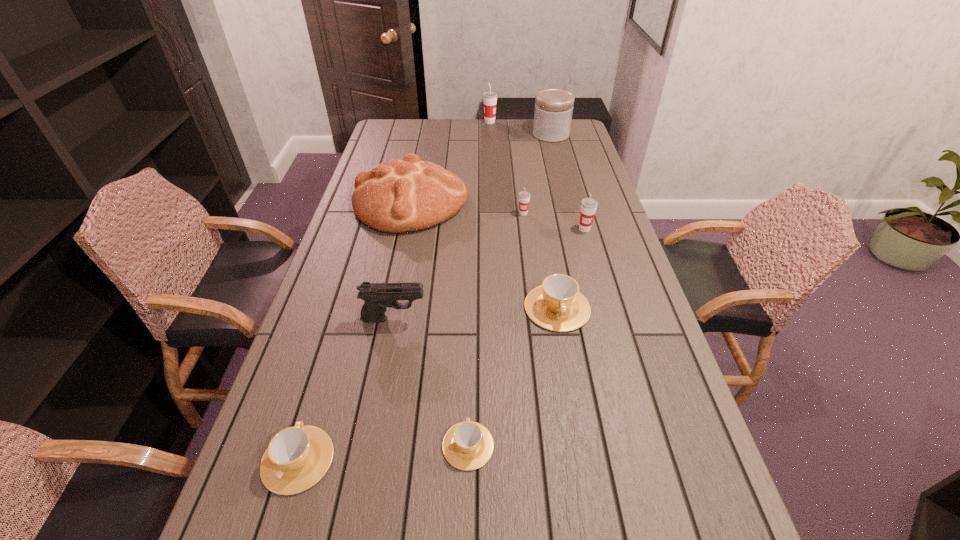
What are the coordinates of `free space that is in between the farthest brown cup and the fifth tallest cup` in the screenshot? It's located at (427, 384).

The height and width of the screenshot is (540, 960). Identify the location of vacant area between the rightmost red cup and the jar. (567, 182).

Find the location of a particular element. This screenshot has height=540, width=960. free space between the biggest brown cup and the second red cup from right to left is located at coordinates (540, 261).

Where is `vacant region between the eighth nearest object and the leftmost red cup`? The image size is (960, 540). vacant region between the eighth nearest object and the leftmost red cup is located at coordinates (520, 128).

The width and height of the screenshot is (960, 540). In order to click on vacant area between the second biggest brown cup and the black pistol in this screenshot , I will do `click(346, 389)`.

Find the location of a particular element. vacant area between the third farthest cup and the leftmost brown cup is located at coordinates (442, 345).

This screenshot has width=960, height=540. I want to click on free point between the fourth farthest cup and the black pistol, so click(475, 313).

In order to click on object that stands as the fifth closest to the jar in this screenshot , I will do click(x=557, y=305).

Select which object appears as the seventh closest to the second red cup from left to right. Please provide its 2D coordinates. Your answer should be formatted as a tuple, i.e. [(x, y)], where the tuple contains the x and y coordinates of a point satisfying the conditions above.

[(468, 445)]

Identify which cup is located as the fourth nearest to the farthest cup. Please provide its 2D coordinates. Your answer should be formatted as a tuple, i.e. [(x, y)], where the tuple contains the x and y coordinates of a point satisfying the conditions above.

[(468, 445)]